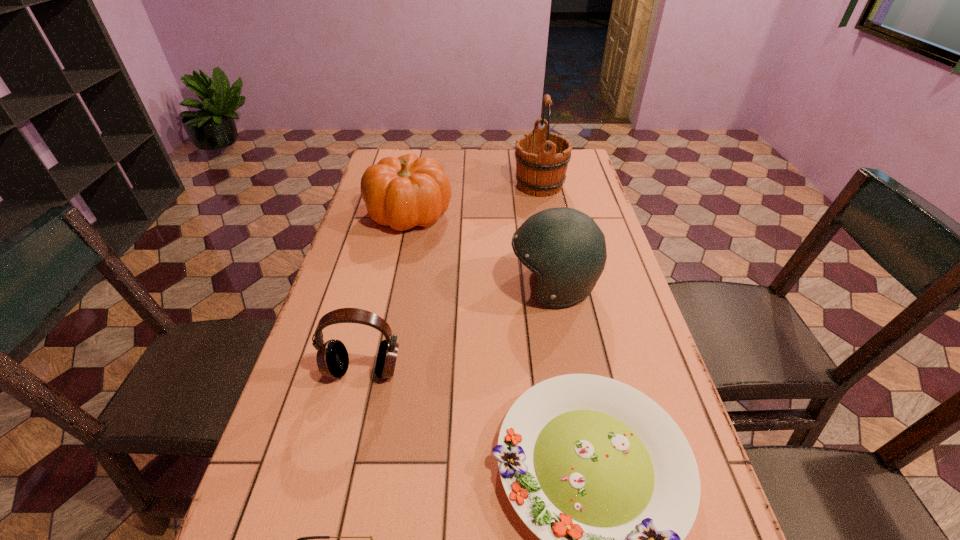
This screenshot has width=960, height=540. What are the coordinates of `object that is at the far edge` in the screenshot? It's located at (542, 159).

The image size is (960, 540). Find the location of `pumpkin present at the left edge`. pumpkin present at the left edge is located at coordinates (408, 191).

Locate an element on the screen. headset that is positioned at the left edge is located at coordinates (332, 357).

Locate an element on the screen. wine bucket that is at the right edge is located at coordinates (542, 159).

Find the location of a particular element. This screenshot has height=540, width=960. football helmet located in the right edge section of the desktop is located at coordinates (566, 249).

Image resolution: width=960 pixels, height=540 pixels. Find the location of `object at the far right corner`. object at the far right corner is located at coordinates (542, 159).

Find the location of `vacant space at the far edge`. vacant space at the far edge is located at coordinates (453, 152).

What are the coordinates of `free space at the left edge` in the screenshot? It's located at (335, 528).

At what (x,y) coordinates should I click in order to perform the action: click on vacant space at the right edge of the desktop. Please return your answer as a coordinate pair (x, y). This screenshot has height=540, width=960. Looking at the image, I should click on (569, 187).

Where is `free space that is in between the headset and the tallest object`? This screenshot has height=540, width=960. free space that is in between the headset and the tallest object is located at coordinates (451, 278).